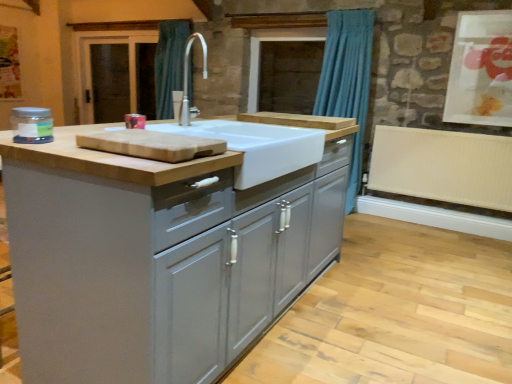
What is the approximate height of blue fabric curtain at upper center?

It is 5.93 feet.

The image size is (512, 384). Describe the element at coordinates (481, 70) in the screenshot. I see `matte paper artwork at upper right` at that location.

You are a GUI agent. You are given a task and a screenshot of the screen. Output one action in this format:
    pyautogui.click(x=<x>, y=<y>)
    Task: Click on the matte paper artwork at upper right
    
    Given the screenshot: What is the action you would take?
    pyautogui.click(x=481, y=70)

Identify the location of white ceramic sink at center. The height and width of the screenshot is (384, 512). (257, 148).

Is brown wooden screen door at left facing towards white ribbed radiator at lower right?

No.

From a real-world perspective, who is located lower, brown wooden screen door at left or white ribbed radiator at lower right?

From a 3D spatial view, white ribbed radiator at lower right is below.

Where is `radiator located underneath the brown wooden screen door at left (from a real-world perspective)`? Image resolution: width=512 pixels, height=384 pixels. radiator located underneath the brown wooden screen door at left (from a real-world perspective) is located at coordinates (443, 166).

Considering the sizes of objects brown wooden screen door at left and white ribbed radiator at lower right in the image provided, who is wider, brown wooden screen door at left or white ribbed radiator at lower right?

white ribbed radiator at lower right.

Which of these two, blue fabric curtain at upper center or matte gray cabinets at center, stands shorter?

matte gray cabinets at center.

Consider the image. Would you say matte gray cabinets at center is part of blue fabric curtain at upper center's contents?

No, matte gray cabinets at center is not a part of blue fabric curtain at upper center.

From a real-world perspective, is blue fabric curtain at upper center positioned above or below matte gray cabinets at center?

blue fabric curtain at upper center is situated higher than matte gray cabinets at center in the real world.

Looking at this image, is blue fabric curtain at upper center to the left or to the right of matte gray cabinets at center in the image?

blue fabric curtain at upper center is to the right of matte gray cabinets at center.

Find the location of a particular element. radiator below the matte glass jar at left (from a real-world perspective) is located at coordinates (443, 166).

Is white ribbed radiator at lower right looking in the opposite direction of matte glass jar at left?

white ribbed radiator at lower right does not have its back to matte glass jar at left.

Considering the sizes of objects white ribbed radiator at lower right and matte glass jar at left in the image provided, who is wider, white ribbed radiator at lower right or matte glass jar at left?

white ribbed radiator at lower right.

Where is `cabinetry below the matte glass jar at left (from the image's perspective)`? cabinetry below the matte glass jar at left (from the image's perspective) is located at coordinates (160, 255).

Considering the sizes of matte gray cabinets at center and matte glass jar at left in the image, is matte gray cabinets at center wider or thinner than matte glass jar at left?

Considering their sizes, matte gray cabinets at center looks broader than matte glass jar at left.

Measure the distance between matte gray cabinets at center and matte glass jar at left.

They are 30.07 inches apart.

Which object is closer to the camera taking this photo, matte gray cabinets at center or matte glass jar at left?

matte gray cabinets at center is more forward.

Which of these two, matte glass jar at left or white ceramic sink at center, stands shorter?

With less height is matte glass jar at left.

Considering the relative sizes of matte glass jar at left and white ceramic sink at center in the image provided, is matte glass jar at left bigger than white ceramic sink at center?

Incorrect, matte glass jar at left is not larger than white ceramic sink at center.

Between matte glass jar at left and white ceramic sink at center, which one appears on the right side from the viewer's perspective?

white ceramic sink at center.

Which is in front, point (39, 120) or point (269, 171)?

The point (39, 120) is closer.

Is white ribbed radiator at lower right oriented away from white ceramic sink at center?

No, white ceramic sink at center is not at the back of white ribbed radiator at lower right.

Between white ribbed radiator at lower right and white ceramic sink at center, which one has more height?

Standing taller between the two is white ribbed radiator at lower right.

Measure the distance from white ribbed radiator at lower right to white ceramic sink at center.

The distance of white ribbed radiator at lower right from white ceramic sink at center is 2.23 meters.

How different are the orientations of white ribbed radiator at lower right and white ceramic sink at center in degrees?

They differ by 91.9 degrees in their facing directions.

Is matte gray cabinets at center positioned far away from blue fabric curtain at upper center?

matte gray cabinets at center is far away from blue fabric curtain at upper center.

Does matte gray cabinets at center come behind blue fabric curtain at upper center?

No.

Can you confirm if matte gray cabinets at center is shorter than blue fabric curtain at upper center?

Yes.

From the image's perspective, relative to blue fabric curtain at upper center, is matte gray cabinets at center above or below?

From the image's perspective, matte gray cabinets at center appears below blue fabric curtain at upper center.

Find the location of a particular element. The width and height of the screenshot is (512, 384). radiator located on the right of brown wooden screen door at left is located at coordinates (443, 166).

Where is `cabinetry directly beneath the blue fabric curtain at upper center (from a real-world perspective)`? The image size is (512, 384). cabinetry directly beneath the blue fabric curtain at upper center (from a real-world perspective) is located at coordinates (160, 255).

In the scene shown: Looking at the image, which one is located further to brown wooden screen door at left, matte glass jar at left or blue fabric curtain at upper center?

matte glass jar at left.

Which object lies further to the anchor point matte paper artwork at upper right, white ribbed radiator at lower right or matte glass jar at left?

matte glass jar at left is positioned further to the anchor matte paper artwork at upper right.

From the image, which object appears to be farther from white ceramic sink at center, matte glass jar at left or matte gray cabinets at center?

matte glass jar at left is further to white ceramic sink at center.

Based on their spatial positions, is brown wooden screen door at left or blue fabric curtain at upper center further from matte paper artwork at upper right?

Based on the image, brown wooden screen door at left appears to be further to matte paper artwork at upper right.

Considering their positions, is white ribbed radiator at lower right positioned closer to matte glass jar at left than matte paper artwork at upper right?

white ribbed radiator at lower right lies closer to matte glass jar at left than the other object.

Based on their spatial positions, is blue fabric curtain at upper center or white ribbed radiator at lower right closer to matte paper artwork at upper right?

Based on the image, white ribbed radiator at lower right appears to be nearer to matte paper artwork at upper right.

When comparing their distances from blue fabric curtain at upper center, does white ceramic sink at center or matte gray cabinets at center seem further?

Among the two, matte gray cabinets at center is located further to blue fabric curtain at upper center.

Considering their positions, is matte paper artwork at upper right positioned further to blue fabric curtain at upper center than white ceramic sink at center?

white ceramic sink at center lies further to blue fabric curtain at upper center than the other object.

This screenshot has width=512, height=384. In order to click on radiator positioned between matte glass jar at left and blue fabric curtain at upper center from near to far in this screenshot , I will do `click(443, 166)`.

The height and width of the screenshot is (384, 512). What are the coordinates of `sink between matte glass jar at left and white ribbed radiator at lower right in the horizontal direction` in the screenshot? It's located at (257, 148).

Locate an element on the screen. The width and height of the screenshot is (512, 384). curtain located between white ceramic sink at center and brown wooden screen door at left in the depth direction is located at coordinates [347, 80].

I want to click on radiator between blue fabric curtain at upper center and matte paper artwork at upper right, so click(x=443, y=166).